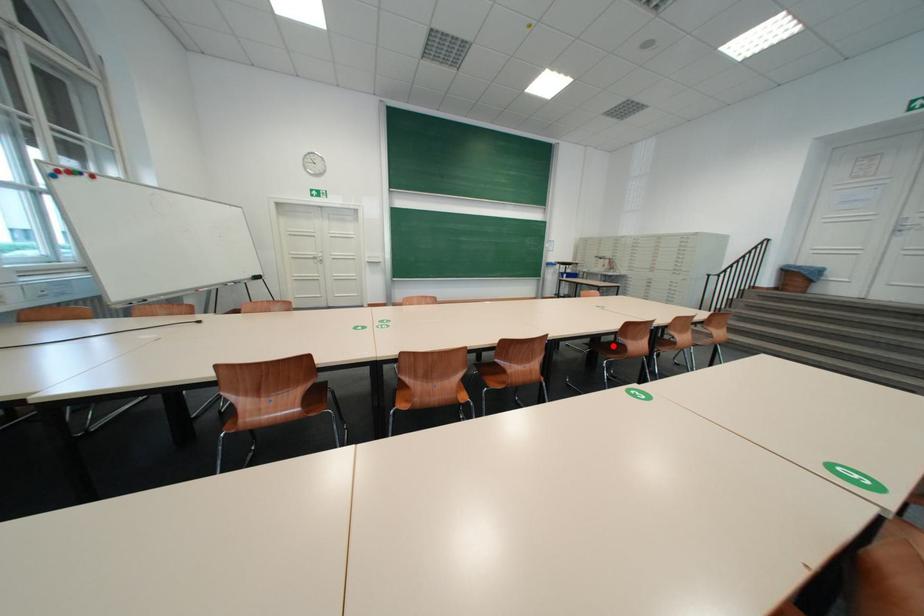
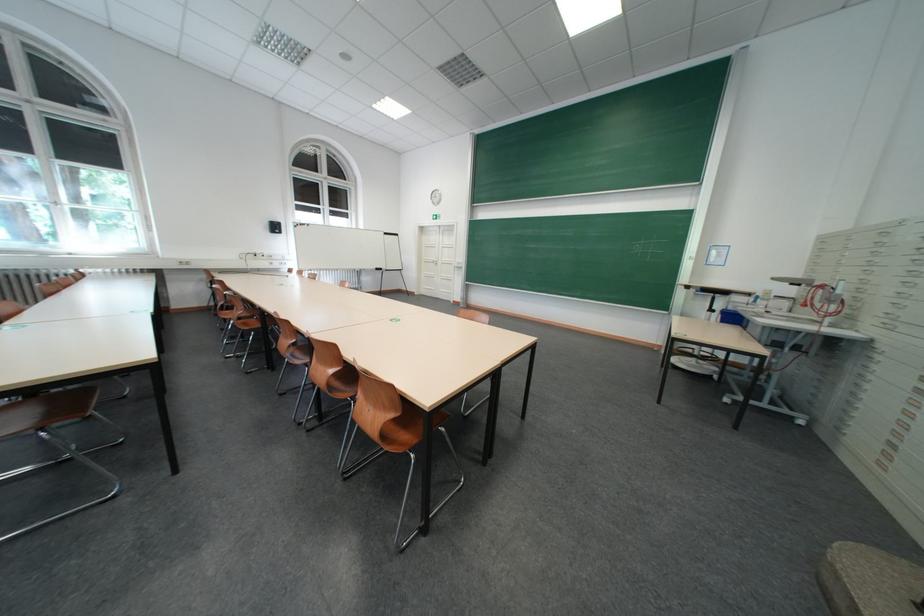
Question: I am providing you with two images of the same scene from different viewpoints. A red point is marked on the first image. Is the red point's position out of view in image 2?

Choices:
 (A) Yes
 (B) No

Answer: (A)